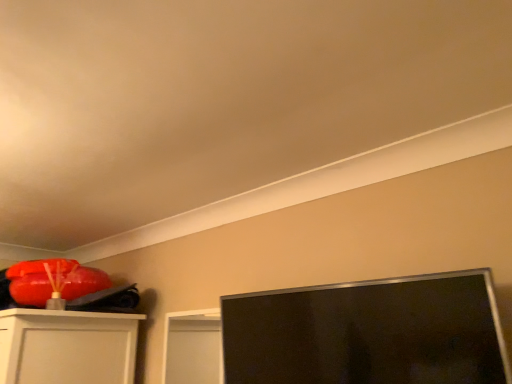
Describe the element at coordinates (50, 282) in the screenshot. I see `matte orange bean bag chair at upper left` at that location.

This screenshot has width=512, height=384. What are the coordinates of `matte orange bean bag chair at upper left` in the screenshot? It's located at (50, 282).

You are a GUI agent. You are given a task and a screenshot of the screen. Output one action in this format:
    pyautogui.click(x=<x>, y=<y>)
    Task: Click on the matte orange bean bag chair at upper left
    
    Given the screenshot: What is the action you would take?
    pyautogui.click(x=50, y=282)